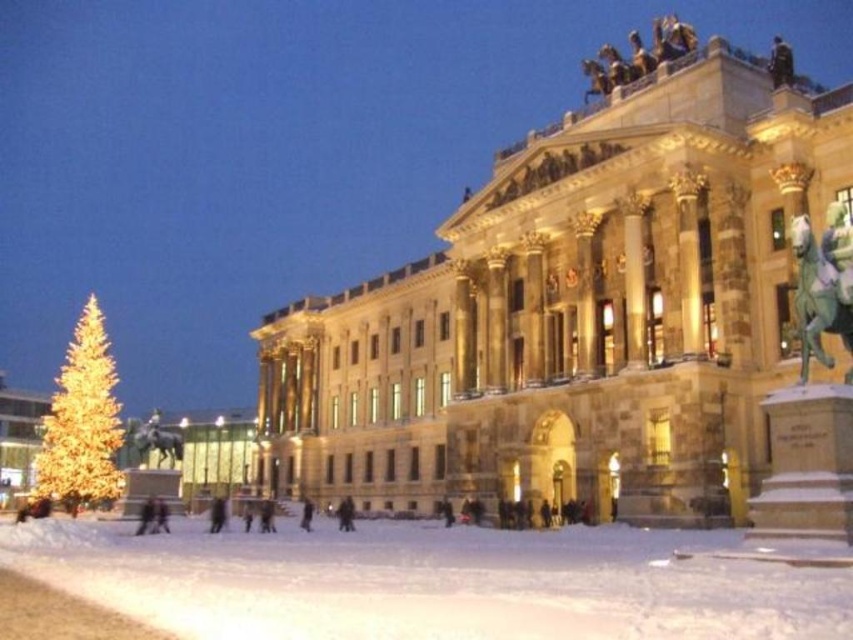
From the picture: You are standing at a point in front of the grand neoclassical building and want to reach the large, brightly lit Christmas tree to the left. The point you are currently at is labeled as point (747, 129). If you need to walk 60 meters to reach the tree, will you be able to reach it from your current position?

The distance between point (747, 129) and the viewer is 57.13 meters, so yes, you can reach the large, brightly lit Christmas tree to the left since the required distance is less than 60 meters.

You are standing in front of the grand neoclassical building and see the white powdery snow at lower center and the dark gray fabric coat at center. Which object is located to the right of the other?

The white powdery snow at lower center is positioned on the right side of dark gray fabric coat at center.